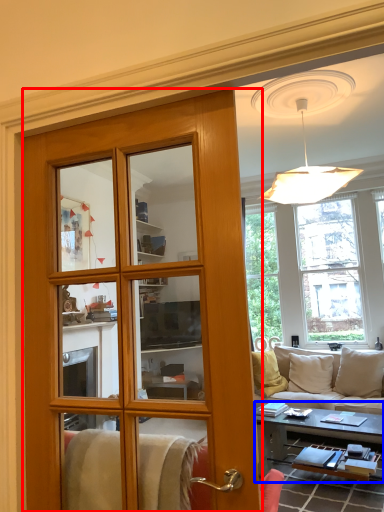
Question: Which point is closer to the camera, door (highlighted by a red box) or table (highlighted by a blue box)?

Choices:
 (A) door
 (B) table

Answer: (A)